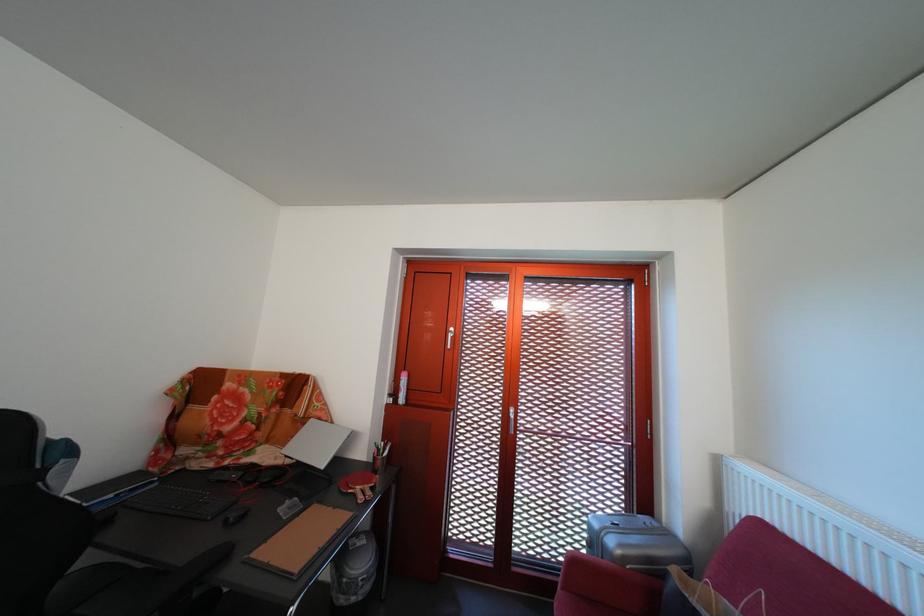
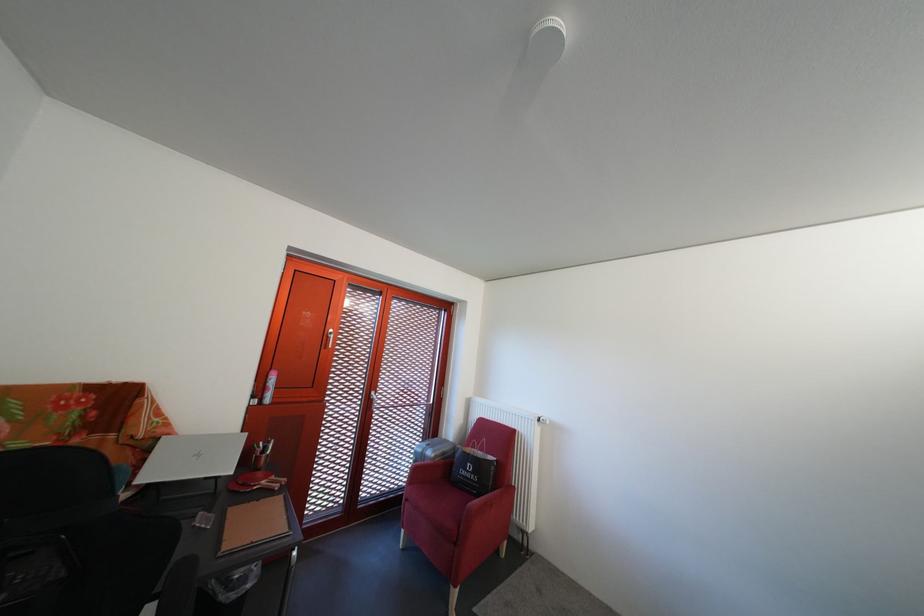
In the second image, find the point that corresponds to the point at 622,549 in the first image.

(441, 459)